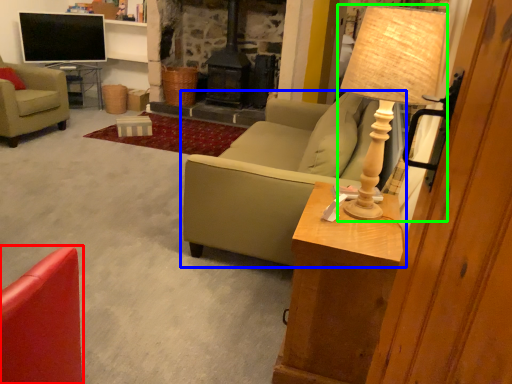
Question: Considering the real-world distances, which object is farthest from chair (highlighted by a red box)? studio couch (highlighted by a blue box) or table lamp (highlighted by a green box)?

Choices:
 (A) studio couch
 (B) table lamp

Answer: (A)